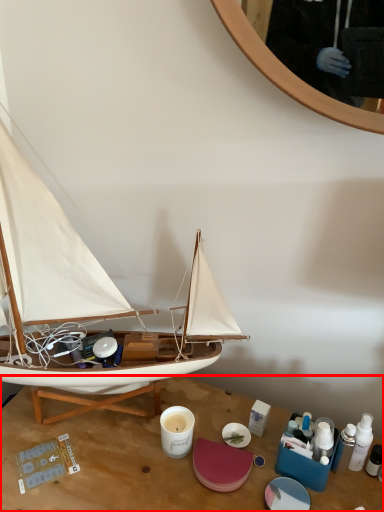
Question: From the image's perspective, where is desk (annotated by the red box) located relative to boat?

Choices:
 (A) below
 (B) above

Answer: (A)